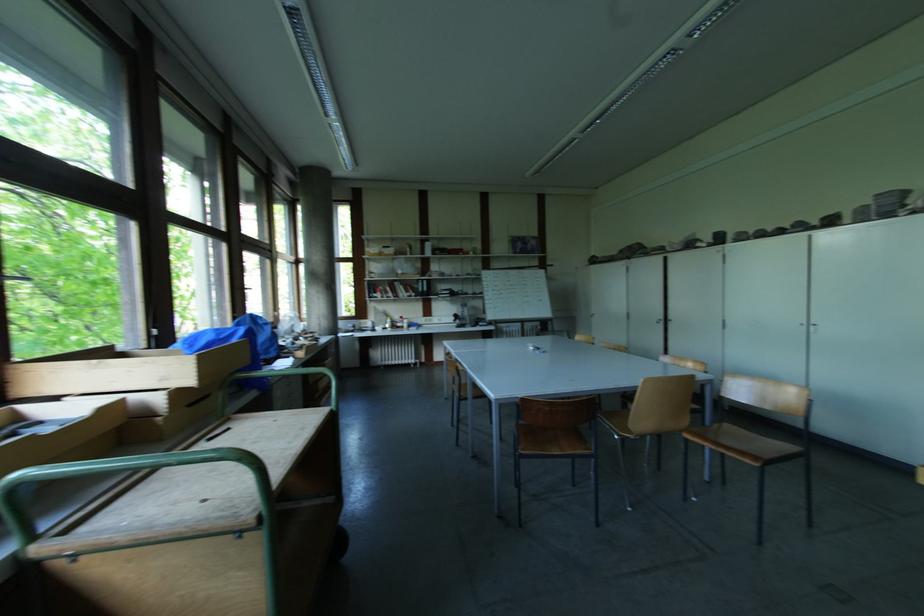
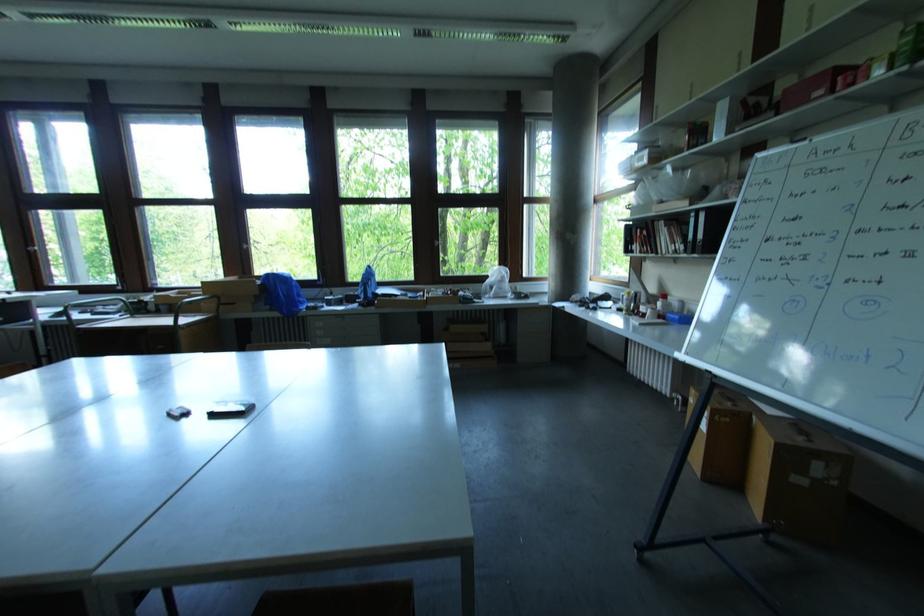
Where in the second image is the point corresponding to (x=405, y=318) from the first image?

(667, 298)